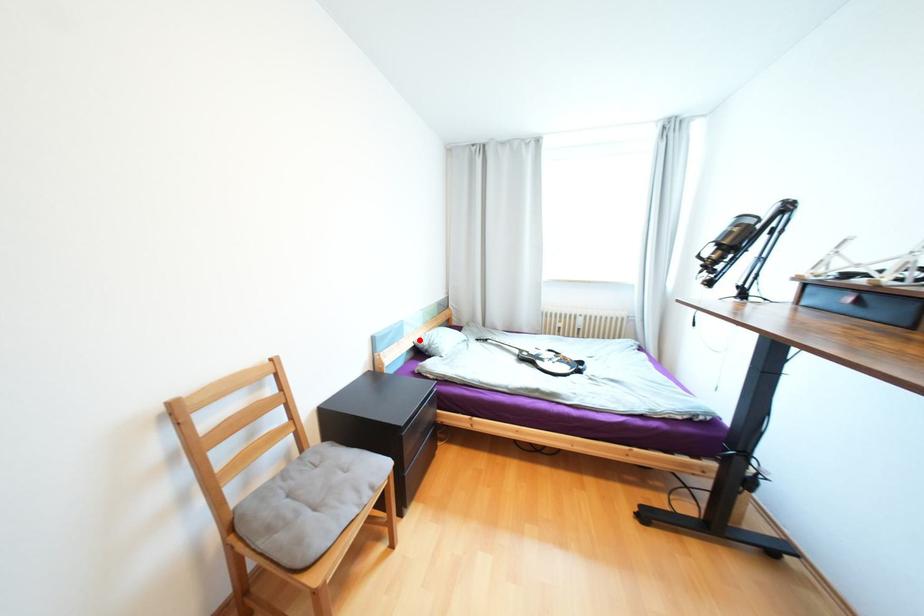
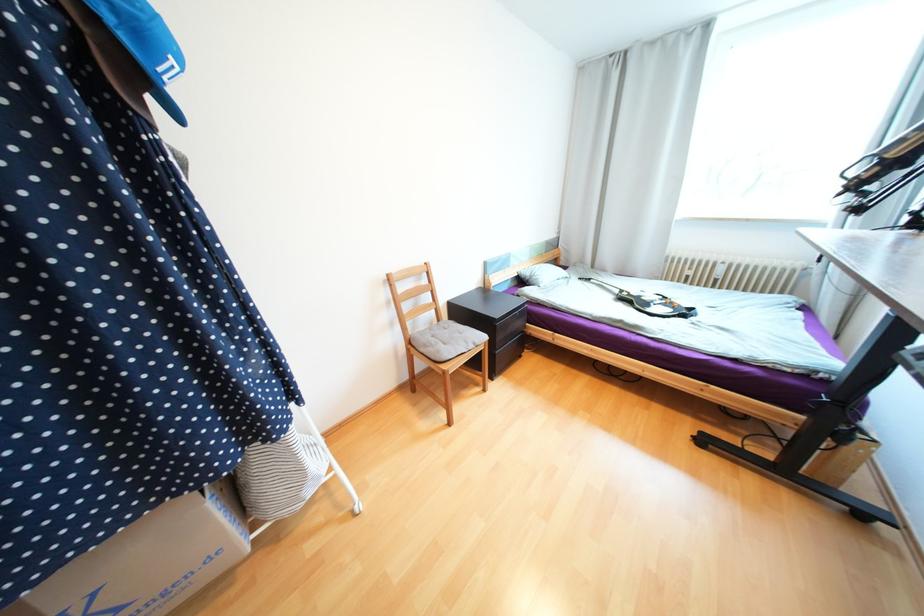
Find the pixel in the second image that matches the highlighted location in the first image.

(524, 270)